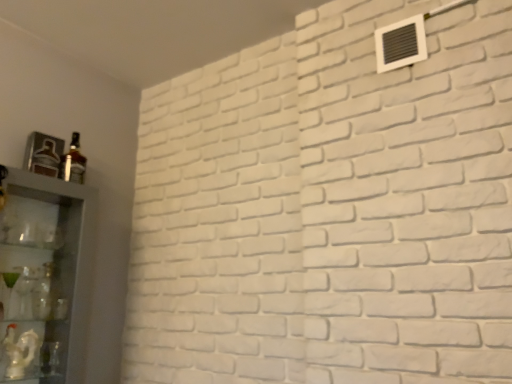
Question: Considering their positions, is matte glass bottle at left located in front of or behind white plastic air conditioning unit at upper right?

Choices:
 (A) front
 (B) behind

Answer: (B)

Question: Is matte glass bottle at left to the left or to the right of white plastic air conditioning unit at upper right in the image?

Choices:
 (A) right
 (B) left

Answer: (B)

Question: Which of these objects is positioned closest to the matte glass bottle at left?

Choices:
 (A) white plastic air conditioning unit at upper right
 (B) clear glass cabinet at left, positioned as the 1th shelf in top-to-bottom order
 (C) white glossy statue at lower left, which ranks as the 2th shelf in top-to-bottom order

Answer: (B)

Question: Considering the real-world distances, which object is farthest from the white glossy statue at lower left, which ranks as the 2th shelf in top-to-bottom order?

Choices:
 (A) matte glass bottle at left
 (B) white plastic air conditioning unit at upper right
 (C) clear glass cabinet at left, marked as the 2th shelf in a bottom-to-top arrangement

Answer: (B)